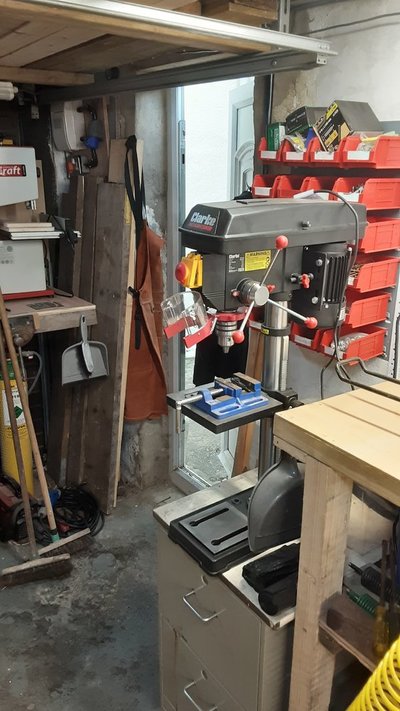
What are the coordinates of `workbench` in the screenshot? It's located at (344, 424).